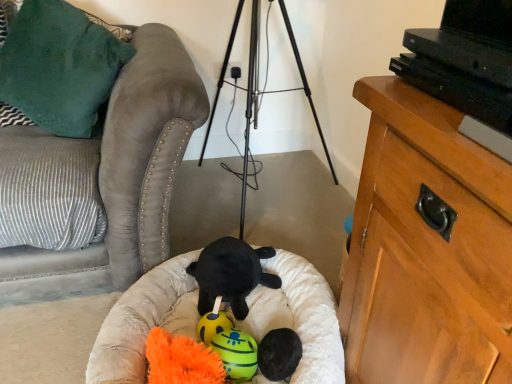
Question: From a real-world perspective, is black plush toy at center, placed as the 3th toy when sorted from front to back, on top of white plush dog bed at center?

Choices:
 (A) no
 (B) yes

Answer: (B)

Question: Considering the relative sizes of black plush toy at center, placed as the 3th toy when sorted from front to back, and white plush dog bed at center in the image provided, is black plush toy at center, placed as the 3th toy when sorted from front to back, smaller than white plush dog bed at center?

Choices:
 (A) yes
 (B) no

Answer: (A)

Question: Can you confirm if black plush toy at center, marked as the second toy in a back-to-front arrangement, is taller than white plush dog bed at center?

Choices:
 (A) yes
 (B) no

Answer: (B)

Question: Is black plush toy at center, marked as the second toy in a back-to-front arrangement, at the right side of white plush dog bed at center?

Choices:
 (A) no
 (B) yes

Answer: (B)

Question: Is black plush toy at center, marked as the second toy in a back-to-front arrangement, positioned with its back to white plush dog bed at center?

Choices:
 (A) no
 (B) yes

Answer: (B)

Question: From the image's perspective, is yellow rubber ball at center, placed as the 1th toy when sorted from back to front, positioned above or below suede couch at left?

Choices:
 (A) below
 (B) above

Answer: (A)

Question: In the image, is yellow rubber ball at center, placed as the 1th toy when sorted from back to front, on the left side or the right side of suede couch at left?

Choices:
 (A) left
 (B) right

Answer: (B)

Question: Which is correct: yellow rubber ball at center, placed as the 1th toy when sorted from back to front, is inside suede couch at left, or outside of it?

Choices:
 (A) outside
 (B) inside

Answer: (A)

Question: Relative to suede couch at left, is yellow rubber ball at center, placed as the 1th toy when sorted from back to front, in front or behind?

Choices:
 (A) front
 (B) behind

Answer: (B)

Question: Is white plush dog bed at center taller or shorter than yellow rubber ball at center, positioned as the third toy in back-to-front order?

Choices:
 (A) tall
 (B) short

Answer: (A)

Question: From the image's perspective, is white plush dog bed at center above or below yellow rubber ball at center, positioned as the third toy in back-to-front order?

Choices:
 (A) above
 (B) below

Answer: (A)

Question: Is white plush dog bed at center wider or thinner than yellow rubber ball at center, positioned as the third toy in back-to-front order?

Choices:
 (A) wide
 (B) thin

Answer: (A)

Question: Is point (338, 336) closer or farther from the camera than point (234, 349)?

Choices:
 (A) farther
 (B) closer

Answer: (B)

Question: Is white plush dog bed at center wider or thinner than wooden cabinet at right?

Choices:
 (A) thin
 (B) wide

Answer: (B)

Question: Considering the positions of point (308, 294) and point (498, 327), is point (308, 294) closer or farther from the camera than point (498, 327)?

Choices:
 (A) closer
 (B) farther

Answer: (B)